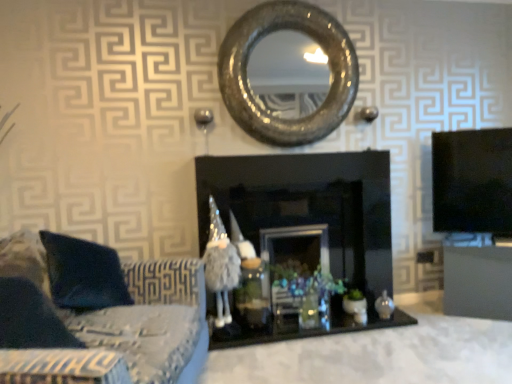
I want to click on empty space that is to the right of black glossy fireplace at center, so click(x=433, y=338).